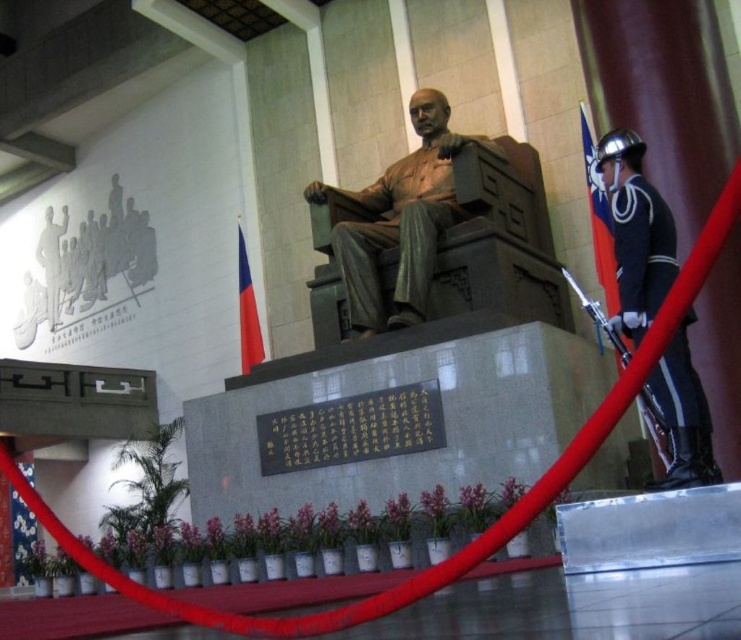
Who is higher up, shiny blue uniform at center or shiny blue uniform at right?

shiny blue uniform at center is above.

Is shiny blue uniform at center taller than shiny blue uniform at right?

Indeed, shiny blue uniform at center has a greater height compared to shiny blue uniform at right.

In order to click on shiny blue uniform at center in this screenshot , I will do `click(398, 228)`.